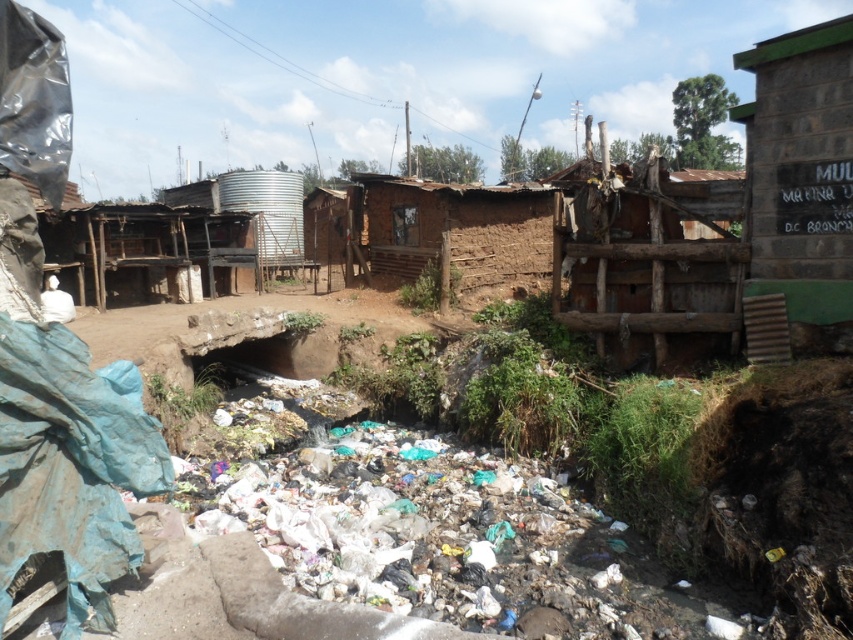
Does green painted mud hut at right have a lesser width compared to brown wooden hut at center?

Incorrect, green painted mud hut at right's width is not less than brown wooden hut at center's.

Is green painted mud hut at right below brown wooden hut at center?

No, green painted mud hut at right is not below brown wooden hut at center.

At what (x,y) coordinates should I click in order to perform the action: click on green painted mud hut at right. Please return your answer as a coordinate pair (x, y). Looking at the image, I should click on (801, 179).